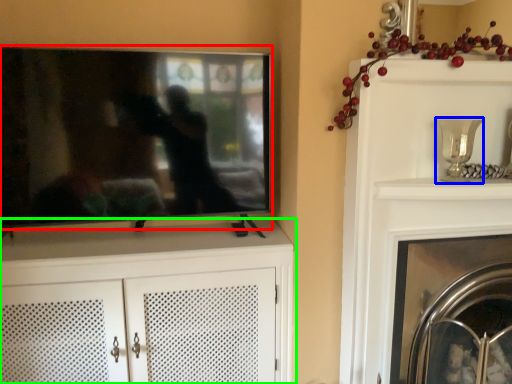
Question: Based on their relative distances, which object is nearer to television (highlighted by a red box)? Choose from candle holder (highlighted by a blue box) and cabinetry (highlighted by a green box).

Choices:
 (A) candle holder
 (B) cabinetry

Answer: (B)